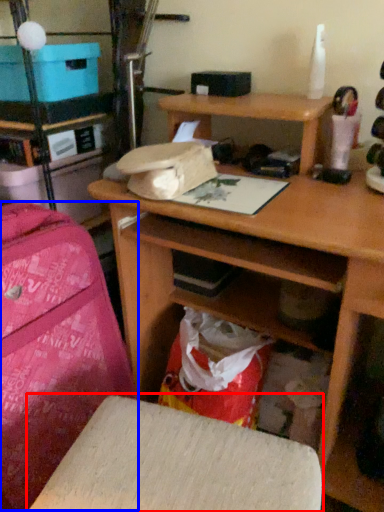
Question: Which of the following is the farthest to the observer, furniture (highlighted by a red box) or luggage (highlighted by a blue box)?

Choices:
 (A) furniture
 (B) luggage

Answer: (B)